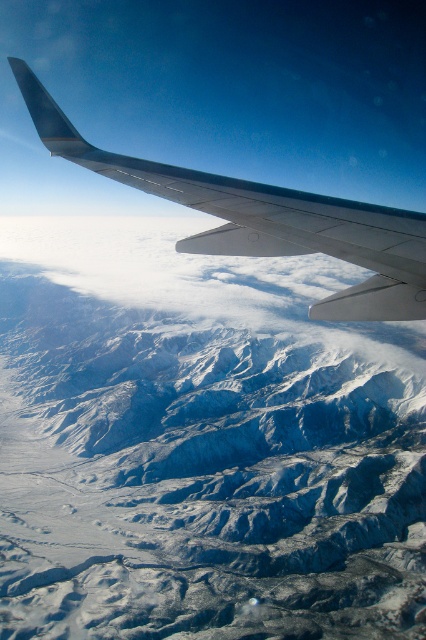
Consider the image. Is snowy rocky mountain range at upper center behind metallic gray wing at upper center?

Yes, it is.

Based on the photo, can you confirm if snowy rocky mountain range at upper center is positioned above metallic gray wing at upper center?

No.

Between point (118, 580) and point (132, 161), which one is positioned in front?

Point (132, 161) is in front.

Identify the location of snowy rocky mountain range at upper center. (199, 477).